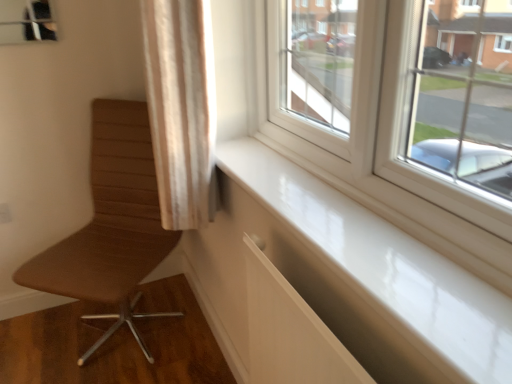
Question: Can you confirm if beige fabric curtain at upper left is taller than white glossy window sill at lower right?

Choices:
 (A) no
 (B) yes

Answer: (B)

Question: Can you confirm if beige fabric curtain at upper left is bigger than white glossy window sill at lower right?

Choices:
 (A) no
 (B) yes

Answer: (B)

Question: Is white glossy window sill at lower right at the back of beige fabric curtain at upper left?

Choices:
 (A) no
 (B) yes

Answer: (A)

Question: Can we say beige fabric curtain at upper left lies outside white glossy window sill at lower right?

Choices:
 (A) yes
 (B) no

Answer: (A)

Question: Does beige fabric curtain at upper left have a smaller size compared to white glossy window sill at lower right?

Choices:
 (A) no
 (B) yes

Answer: (A)

Question: Does beige fabric curtain at upper left have a lesser width compared to white glossy window sill at lower right?

Choices:
 (A) no
 (B) yes

Answer: (A)

Question: Is brown leather chair at left not close to white glossy window sill at lower right?

Choices:
 (A) no
 (B) yes

Answer: (A)

Question: Is brown leather chair at left facing towards white glossy window sill at lower right?

Choices:
 (A) yes
 (B) no

Answer: (B)

Question: Is brown leather chair at left smaller than white glossy window sill at lower right?

Choices:
 (A) yes
 (B) no

Answer: (B)

Question: From a real-world perspective, is brown leather chair at left below white glossy window sill at lower right?

Choices:
 (A) no
 (B) yes

Answer: (B)

Question: Does brown leather chair at left lie behind white glossy window sill at lower right?

Choices:
 (A) yes
 (B) no

Answer: (A)

Question: Is brown leather chair at left wider than white glossy window sill at lower right?

Choices:
 (A) yes
 (B) no

Answer: (A)

Question: Is white glossy window sill at lower right bigger than beige fabric curtain at upper left?

Choices:
 (A) no
 (B) yes

Answer: (A)